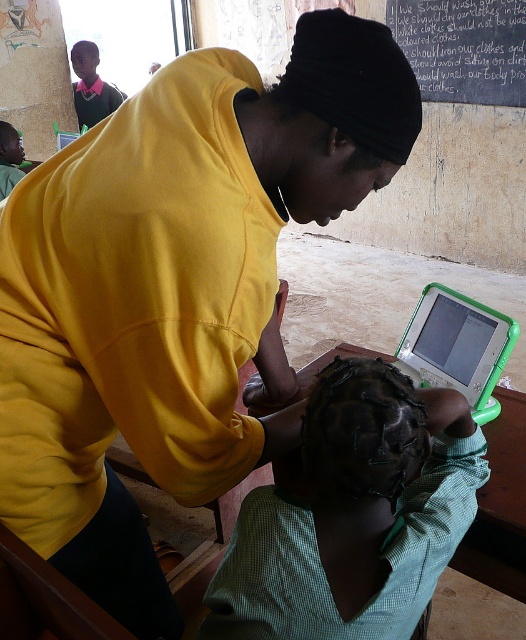
Based on the photo, which is below, green plastic laptop at lower right or green plastic table at lower center?

green plastic table at lower center

Is green plastic laptop at lower right above green plastic table at lower center?

Indeed, green plastic laptop at lower right is positioned over green plastic table at lower center.

At what (x,y) coordinates should I click in order to perform the action: click on green plastic laptop at lower right. Please return your answer as a coordinate pair (x, y). The image size is (526, 640). Looking at the image, I should click on tap(458, 346).

Who is higher up, green checkered shirt at lower center or green plastic table at lower center?

green plastic table at lower center is higher up.

Can you confirm if green checkered shirt at lower center is positioned below green plastic table at lower center?

Indeed, green checkered shirt at lower center is positioned under green plastic table at lower center.

Which is in front, point (392, 512) or point (298, 490)?

Point (392, 512) is in front.

I want to click on green checkered shirt at lower center, so click(353, 515).

Does green checkered shirt at lower center have a lesser height compared to green plastic laptop at lower right?

No.

Locate an element on the screen. green checkered shirt at lower center is located at coordinates (353, 515).